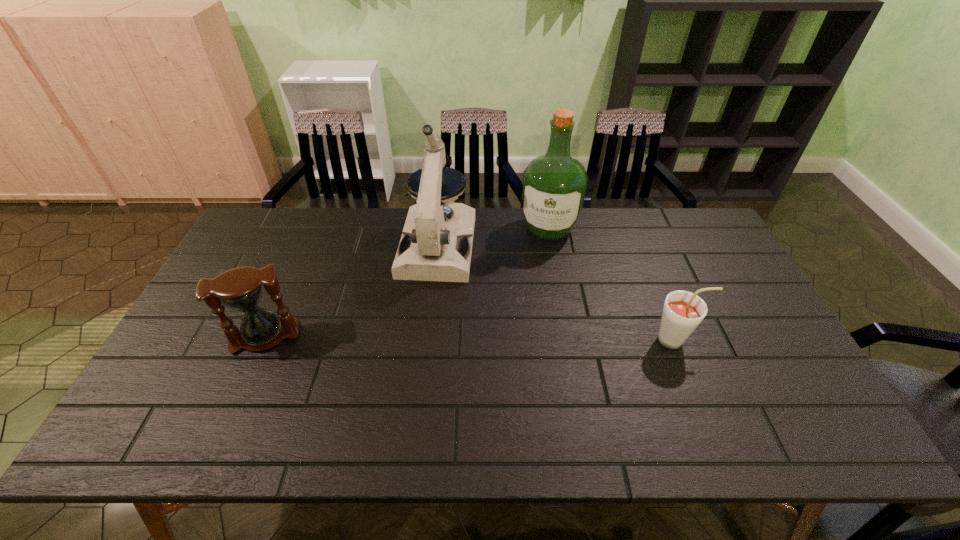
Where is `free spot located 0.270m at the eyepiece of the microscope`? The height and width of the screenshot is (540, 960). free spot located 0.270m at the eyepiece of the microscope is located at coordinates (417, 355).

Locate an element on the screen. This screenshot has height=540, width=960. blank space located on the front-facing side of the third object from left to right is located at coordinates (529, 327).

Find the location of a particular element. vacant region located 0.370m on the front-facing side of the third object from left to right is located at coordinates (528, 333).

Locate an element on the screen. Image resolution: width=960 pixels, height=540 pixels. vacant position located on the front-facing side of the third object from left to right is located at coordinates tap(541, 265).

Find the location of a particular element. microscope at the far edge is located at coordinates (430, 249).

You are a GUI agent. You are given a task and a screenshot of the screen. Output one action in this format:
    pyautogui.click(x=<x>, y=<y>)
    Task: Click on the liquor that is at the far edge
    The image size is (960, 540).
    Given the screenshot: What is the action you would take?
    pyautogui.click(x=554, y=185)

Where is `object present at the left edge`? object present at the left edge is located at coordinates (241, 288).

Locate an element on the screen. The image size is (960, 540). vacant space at the far edge of the desktop is located at coordinates (605, 224).

Where is `free spot at the near edge of the desktop`? This screenshot has height=540, width=960. free spot at the near edge of the desktop is located at coordinates (382, 403).

I want to click on vacant space at the right edge, so click(728, 327).